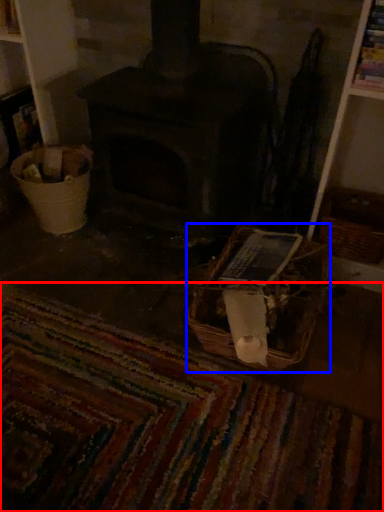
Question: Which of the following is the closest to the observer, mat (highlighted by a red box) or basket (highlighted by a blue box)?

Choices:
 (A) mat
 (B) basket

Answer: (A)